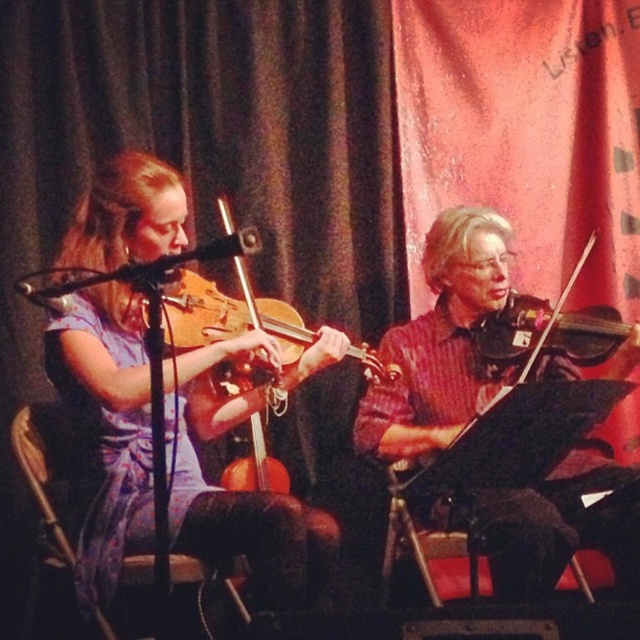
You are a sound technician adjusting the microphone stand for the violinists. The matte wood violin at left and wooden violin at left are both in your view. Which violin is closer to the microphone stand?

The matte wood violin at left is positioned under wooden violin at left, so the matte wood violin at left is closer to the microphone stand since it is underneath the other violin.

You are a stagehand setting up a spotlight for the violinist. The spotlight needs to be placed at coordinates point A, which is at position point A. Where should you aim the spotlight to ensure it hits the matte black violin at center?

The matte black violin at center is located at point A, so you should aim the spotlight directly at point A to hit it.